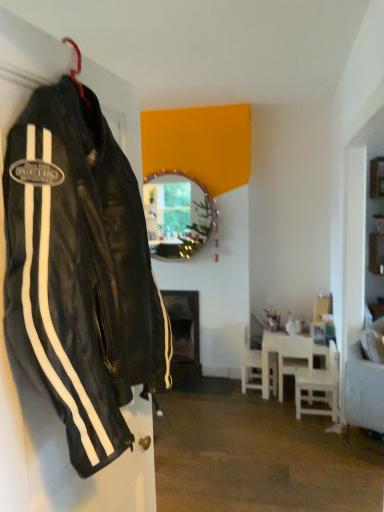
The height and width of the screenshot is (512, 384). What do you see at coordinates (251, 366) in the screenshot?
I see `white plastic chair at lower right, which appears as the third chair when viewed from the front` at bounding box center [251, 366].

Locate an element on the screen. white plastic chair at lower right, arranged as the 1th chair when viewed from the back is located at coordinates (251, 366).

From the picture: Does white wooden chair at lower right, positioned as the 2th chair in back-to-front order, have a greater width compared to white plastic chair at lower right, arranged as the 1th chair when viewed from the back?

No.

In the scene shown: Is white wooden chair at lower right, which is the second chair in front-to-back order, oriented towards white plastic chair at lower right, arranged as the 1th chair when viewed from the back?

No.

What's the angular difference between white wooden chair at lower right, positioned as the 2th chair in back-to-front order, and white plastic chair at lower right, which appears as the third chair when viewed from the front,'s facing directions?

The angle between the facing direction of white wooden chair at lower right, positioned as the 2th chair in back-to-front order, and the facing direction of white plastic chair at lower right, which appears as the third chair when viewed from the front, is 92.2 degrees.

Considering the relative positions of white wooden chair at lower right, which is the second chair in front-to-back order, and white plastic chair at lower right, which appears as the third chair when viewed from the front, in the image provided, is white wooden chair at lower right, which is the second chair in front-to-back order, to the left of white plastic chair at lower right, which appears as the third chair when viewed from the front, from the viewer's perspective?

No.

Is black leather jacket at left to the left or to the right of white plastic chair at lower right, which appears as the first chair when viewed from the front, in the image?

black leather jacket at left is to the left of white plastic chair at lower right, which appears as the first chair when viewed from the front.

Find the location of a particular element. This screenshot has height=512, width=384. jacket above the white plastic chair at lower right, arranged as the third chair when viewed from the back (from the image's perspective) is located at coordinates [80, 272].

Which point is more forward, (x=124, y=374) or (x=301, y=385)?

The point (x=124, y=374) is more forward.

Is shiny metallic mirror at center to the right of white plastic chair at lower right, arranged as the 1th chair when viewed from the back, from the viewer's perspective?

No.

From the image's perspective, which is above, shiny metallic mirror at center or white plastic chair at lower right, which appears as the third chair when viewed from the front?

shiny metallic mirror at center is shown above in the image.

Between point (178, 231) and point (275, 385), which one is positioned behind?

The point (178, 231) is farther from the camera.

Consider the image. Does white wooden chair at lower right, positioned as the 2th chair in back-to-front order, come behind white plastic chair at lower right, which appears as the first chair when viewed from the front?

Yes, white wooden chair at lower right, positioned as the 2th chair in back-to-front order, is further from the camera.

Is white wooden chair at lower right, which is the second chair in front-to-back order, to the left of white plastic chair at lower right, which appears as the first chair when viewed from the front, from the viewer's perspective?

Indeed, white wooden chair at lower right, which is the second chair in front-to-back order, is positioned on the left side of white plastic chair at lower right, which appears as the first chair when viewed from the front.

Is white wooden chair at lower right, positioned as the 2th chair in back-to-front order, facing towards white plastic chair at lower right, arranged as the third chair when viewed from the back?

No, white wooden chair at lower right, positioned as the 2th chair in back-to-front order, is not facing towards white plastic chair at lower right, arranged as the third chair when viewed from the back.

From a real-world perspective, relative to black leather jacket at left, is white wooden chair at lower right, which is the second chair in front-to-back order, vertically above or below?

In terms of real-world spatial position, white wooden chair at lower right, which is the second chair in front-to-back order, is below black leather jacket at left.

Would you say black leather jacket at left is part of white wooden chair at lower right, positioned as the 2th chair in back-to-front order,'s contents?

No.

Consider the image. From the image's perspective, would you say white wooden chair at lower right, positioned as the 2th chair in back-to-front order, is positioned over black leather jacket at left?

No, from the image's perspective, white wooden chair at lower right, positioned as the 2th chair in back-to-front order, is not on top of black leather jacket at left.

In the image, there is a white wooden chair at lower right, which is the second chair in front-to-back order. Where is `jacket above it (from the image's perspective)`? The image size is (384, 512). jacket above it (from the image's perspective) is located at coordinates (80, 272).

From a real-world perspective, is white plastic chair at lower right, which appears as the first chair when viewed from the front, physically located above or below shiny metallic mirror at center?

From a real-world perspective, white plastic chair at lower right, which appears as the first chair when viewed from the front, is physically below shiny metallic mirror at center.

Is white plastic chair at lower right, which appears as the first chair when viewed from the front, oriented away from shiny metallic mirror at center?

No, white plastic chair at lower right, which appears as the first chair when viewed from the front, is not facing away from shiny metallic mirror at center.

Can you confirm if white plastic chair at lower right, arranged as the third chair when viewed from the back, is shorter than shiny metallic mirror at center?

Correct, white plastic chair at lower right, arranged as the third chair when viewed from the back, is not as tall as shiny metallic mirror at center.

Who is bigger, white plastic chair at lower right, which appears as the first chair when viewed from the front, or shiny metallic mirror at center?

With larger size is shiny metallic mirror at center.

Is white wooden chair at lower right, positioned as the 2th chair in back-to-front order, closer to the viewer compared to shiny metallic mirror at center?

Yes, white wooden chair at lower right, positioned as the 2th chair in back-to-front order, is closer to the viewer.

In terms of size, does white wooden chair at lower right, positioned as the 2th chair in back-to-front order, appear bigger or smaller than shiny metallic mirror at center?

Clearly, white wooden chair at lower right, positioned as the 2th chair in back-to-front order, is smaller in size than shiny metallic mirror at center.

Is white wooden chair at lower right, positioned as the 2th chair in back-to-front order, facing towards shiny metallic mirror at center?

No, white wooden chair at lower right, positioned as the 2th chair in back-to-front order, is not oriented towards shiny metallic mirror at center.

Is white wooden chair at lower right, positioned as the 2th chair in back-to-front order, directly adjacent to shiny metallic mirror at center?

No, white wooden chair at lower right, positioned as the 2th chair in back-to-front order, is not with shiny metallic mirror at center.

From the white plastic chair at lower right, which appears as the third chair when viewed from the front, count 1st chairs forward and point to it. Please provide its 2D coordinates.

[(293, 357)]

You are a GUI agent. You are given a task and a screenshot of the screen. Output one action in this format:
    pyautogui.click(x=<x>, y=<y>)
    Task: Click on the jacket that is on the left side of white plastic chair at lower right, which appears as the first chair when viewed from the front
    The height and width of the screenshot is (512, 384).
    Given the screenshot: What is the action you would take?
    pyautogui.click(x=80, y=272)

Based on their spatial positions, is white wooden chair at lower right, which is the second chair in front-to-back order, or black leather jacket at left closer to shiny metallic mirror at center?

white wooden chair at lower right, which is the second chair in front-to-back order.

From the image, which object appears to be farther from white wooden table at lower right, white wooden chair at lower right, which is the second chair in front-to-back order, or shiny metallic mirror at center?

shiny metallic mirror at center is positioned further to the anchor white wooden table at lower right.

Considering their positions, is white wooden chair at lower right, positioned as the 2th chair in back-to-front order, positioned further to white plastic chair at lower right, which appears as the third chair when viewed from the front, than white plastic chair at lower right, which appears as the first chair when viewed from the front?

white plastic chair at lower right, which appears as the first chair when viewed from the front, lies further to white plastic chair at lower right, which appears as the third chair when viewed from the front, than the other object.

When comparing their distances from white plastic chair at lower right, which appears as the first chair when viewed from the front, does white wooden chair at lower right, positioned as the 2th chair in back-to-front order, or white wooden table at lower right seem further?

white wooden chair at lower right, positioned as the 2th chair in back-to-front order.

Looking at the image, which one is located further to white plastic chair at lower right, arranged as the third chair when viewed from the back, shiny metallic mirror at center or white plastic chair at lower right, which appears as the third chair when viewed from the front?

Among the two, shiny metallic mirror at center is located further to white plastic chair at lower right, arranged as the third chair when viewed from the back.

Consider the image. Considering their positions, is shiny metallic mirror at center positioned further to black leather jacket at left than white plastic chair at lower right, which appears as the first chair when viewed from the front?

Among the two, shiny metallic mirror at center is located further to black leather jacket at left.

Considering their positions, is black leather jacket at left positioned closer to white wooden chair at lower right, which is the second chair in front-to-back order, than white wooden table at lower right?

white wooden table at lower right.

Based on their spatial positions, is black leather jacket at left or white wooden chair at lower right, which is the second chair in front-to-back order, further from white plastic chair at lower right, arranged as the 1th chair when viewed from the back?

black leather jacket at left is positioned further to the anchor white plastic chair at lower right, arranged as the 1th chair when viewed from the back.

Find the location of `table between shiny metallic mirror at center and white plastic chair at lower right, arranged as the third chair when viewed from the back, in the up-down direction`. table between shiny metallic mirror at center and white plastic chair at lower right, arranged as the third chair when viewed from the back, in the up-down direction is located at coordinates (288, 357).

Locate an element on the screen. This screenshot has width=384, height=512. chair between white plastic chair at lower right, which appears as the third chair when viewed from the front, and white wooden table at lower right is located at coordinates (293, 357).

Image resolution: width=384 pixels, height=512 pixels. I want to click on chair between black leather jacket at left and white wooden chair at lower right, positioned as the 2th chair in back-to-front order, from front to back, so click(x=318, y=387).

Locate an element on the screen. The image size is (384, 512). chair that lies between shiny metallic mirror at center and white wooden chair at lower right, positioned as the 2th chair in back-to-front order, from top to bottom is located at coordinates (251, 366).